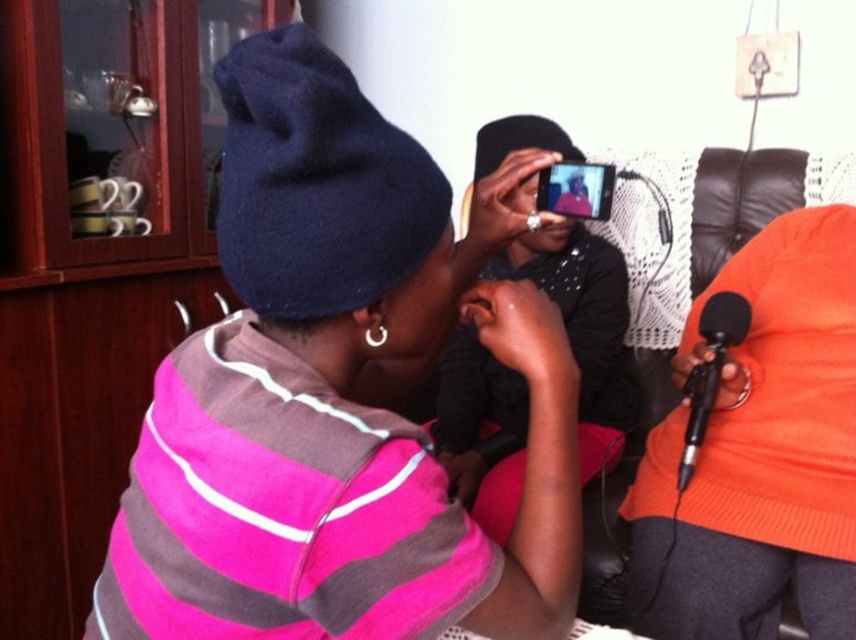
You are setting up a camera shot and need to ensure that both the matte black beanie at upper left and the black metallic microphone at lower right are visible in the frame. Based on their heights, which object should you adjust the camera angle to prioritize keeping in the frame?

The matte black beanie at upper left is taller than the black metallic microphone at lower right, so you should prioritize keeping the matte black beanie at upper left in the frame since it is taller and might be more likely to be cut off if not properly framed.

Based on the coordinates provided, which object in the scene corresponds to the point labeled as point (x=759, y=452)?

The point (x=759, y=452) corresponds to the orange knitted sweater at right.